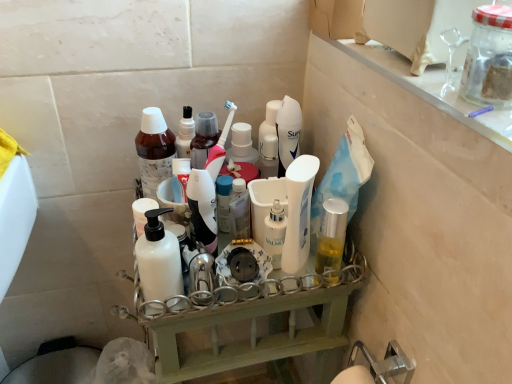
Question: Can you confirm if white matte bottle at center, marked as the second bottle in a back-to-front arrangement, is shorter than white glossy lotion at center?

Choices:
 (A) no
 (B) yes

Answer: (B)

Question: Is white matte bottle at center, which ranks as the first bottle in bottom-to-top order, not near white glossy lotion at center?

Choices:
 (A) yes
 (B) no

Answer: (B)

Question: From the image's perspective, does white matte bottle at center, the 1th bottle positioned from the front, appear lower than white glossy lotion at center?

Choices:
 (A) yes
 (B) no

Answer: (A)

Question: Does white matte bottle at center, the 1th bottle positioned from the front, have a greater height compared to white glossy lotion at center?

Choices:
 (A) no
 (B) yes

Answer: (A)

Question: From the image's perspective, is white matte bottle at center, marked as the second bottle in a back-to-front arrangement, on top of white glossy lotion at center?

Choices:
 (A) no
 (B) yes

Answer: (A)

Question: From a real-world perspective, is white matte bottle at center, arranged as the 2th bottle when viewed from the top, located higher than white glossy lotion at center?

Choices:
 (A) no
 (B) yes

Answer: (A)

Question: Does white glossy lotion at center have a greater height compared to white glossy lotion at center, acting as the 1th toiletry starting from the right?

Choices:
 (A) yes
 (B) no

Answer: (A)

Question: Is white glossy lotion at center shorter than white glossy lotion at center, acting as the 1th toiletry starting from the right?

Choices:
 (A) yes
 (B) no

Answer: (B)

Question: Would you consider white glossy lotion at center to be distant from white glossy lotion at center, the 2th toiletry viewed from the left?

Choices:
 (A) yes
 (B) no

Answer: (B)

Question: Is white glossy lotion at center bigger than white glossy lotion at center, acting as the 1th toiletry starting from the right?

Choices:
 (A) no
 (B) yes

Answer: (B)

Question: Can you confirm if white glossy lotion at center is thinner than white glossy lotion at center, the 2th toiletry viewed from the left?

Choices:
 (A) yes
 (B) no

Answer: (A)

Question: Would you say white glossy lotion at center, the 2th toiletry viewed from the left, is part of white glossy lotion at center's contents?

Choices:
 (A) no
 (B) yes

Answer: (A)

Question: Is the position of white plastic shelf at center more distant than that of clear glass shelf at upper right?

Choices:
 (A) no
 (B) yes

Answer: (B)